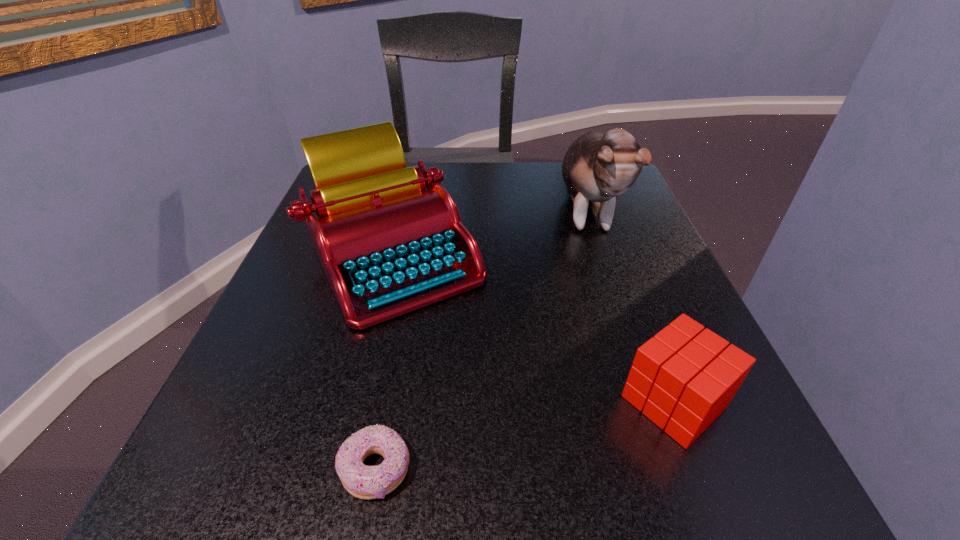
Locate an element on the screen. The height and width of the screenshot is (540, 960). free space between the cat and the cube is located at coordinates (630, 306).

You are a GUI agent. You are given a task and a screenshot of the screen. Output one action in this format:
    pyautogui.click(x=<x>, y=<y>)
    Task: Click on the empty space between the third tallest object and the doughnut
    The width and height of the screenshot is (960, 540).
    Given the screenshot: What is the action you would take?
    pyautogui.click(x=525, y=435)

Where is `unoccupied position between the shortest object and the tallest object`? The width and height of the screenshot is (960, 540). unoccupied position between the shortest object and the tallest object is located at coordinates (480, 340).

Point out which object is positioned as the nearest to the doughnut. Please provide its 2D coordinates. Your answer should be formatted as a tuple, i.e. [(x, y)], where the tuple contains the x and y coordinates of a point satisfying the conditions above.

[(389, 237)]

This screenshot has width=960, height=540. Identify the location of the second closest object to the second tallest object. (366, 482).

Find the location of a particular element. Image resolution: width=960 pixels, height=540 pixels. blank space that satisfies the following two spatial constraints: 1. on the typing side of the cube; 2. on the right side of the second tallest object is located at coordinates (357, 401).

Locate an element on the screen. vacant area in the image that satisfies the following two spatial constraints: 1. on the typing side of the third tallest object; 2. on the left side of the typewriter is located at coordinates (357, 401).